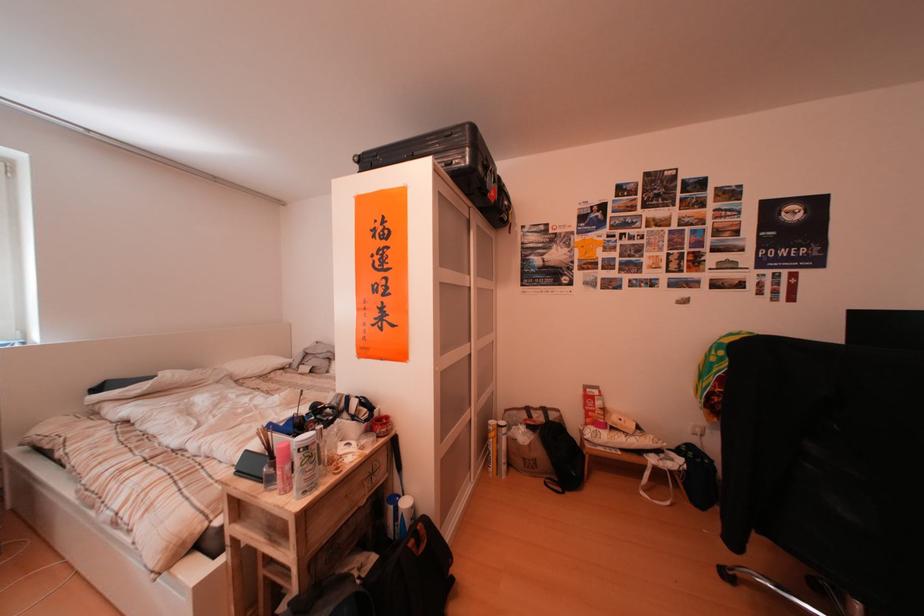
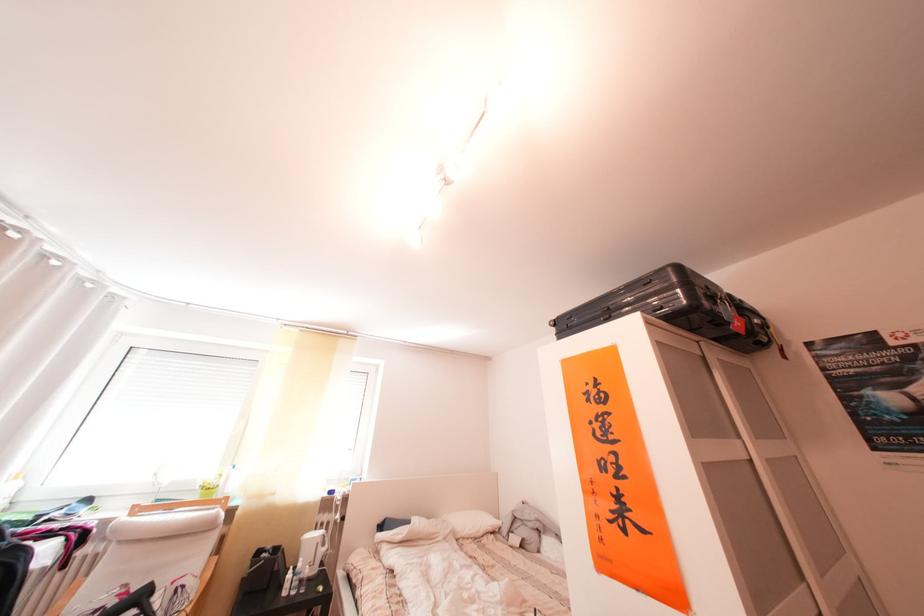
Where in the second image is the point corresponding to pixel 378 329 from the first image?

(610, 522)